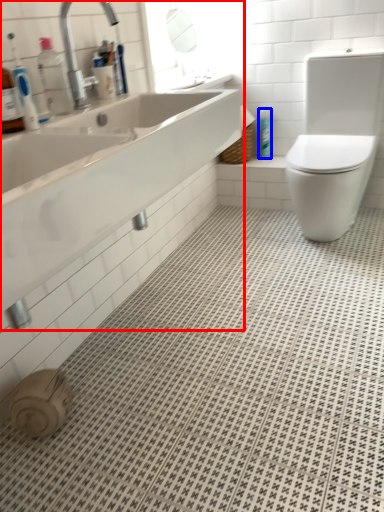
Question: Which object is further to the camera taking this photo, sink (highlighted by a red box) or toiletry (highlighted by a blue box)?

Choices:
 (A) sink
 (B) toiletry

Answer: (B)